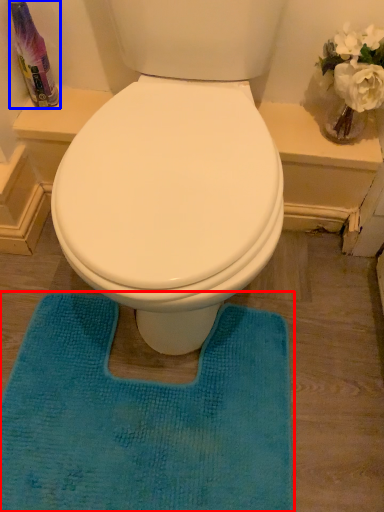
Question: Which object appears farthest to the camera in this image, bath mat (highlighted by a red box) or cleaning product (highlighted by a blue box)?

Choices:
 (A) bath mat
 (B) cleaning product

Answer: (B)